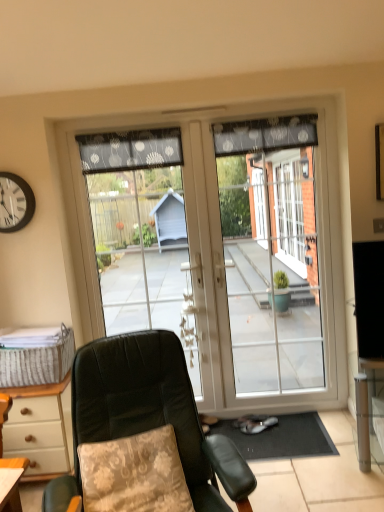
Locate an element on the screen. Image resolution: width=384 pixels, height=512 pixels. vacant area on top of transparent glass door at center (from a real-world perspective) is located at coordinates (126, 123).